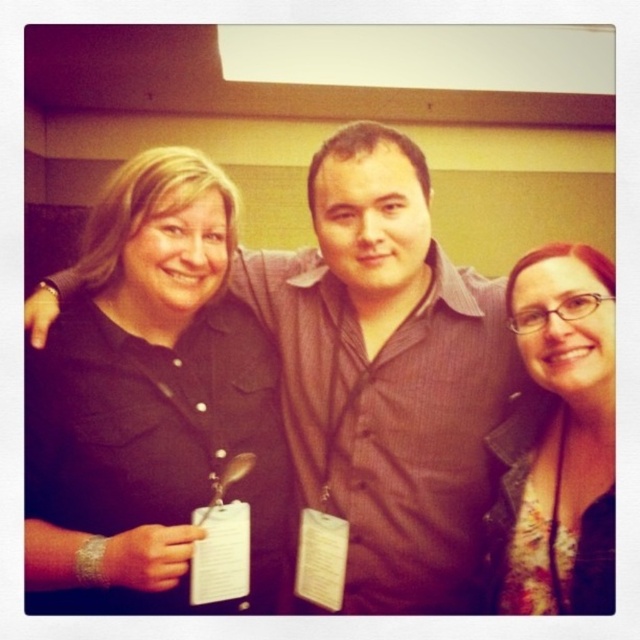
You are organizing a clothing donation drive and need to determine if the black shirt at center can fit into a standard donation box that accommodates items up to the size of the floral fabric shirt at center. Based on the image, what should you conclude?

The black shirt at center is bigger than the floral fabric shirt at center, so it will not fit into the donation box designed for items up to the size of the floral fabric shirt at center.

You are standing in front of the three people in the image and want to hand a gift to the person behind the floral fabric shirt at center. Can you directly reach them without moving around the black shirt at center?

The black shirt at center is further to the viewer than floral fabric shirt at center, so you cannot directly reach the person behind the floral fabric shirt at center without moving around the black shirt at center.

You are standing in front of the three people in the image. Which of the two points, point 1 at coordinates (372, 413) or point 2 at (545, 477), is closer to you?

Point 1 at coordinates (372, 413) is closer to you because it is further to the viewer than point 2 at (545, 477).